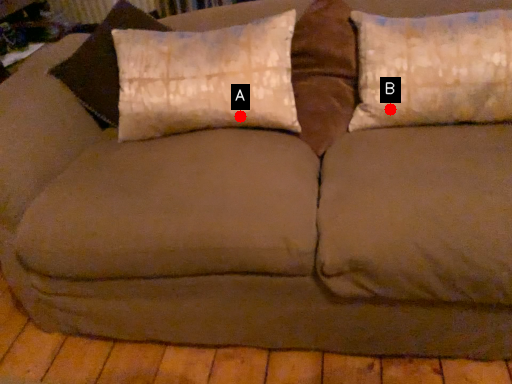
Question: Two points are circled on the image, labeled by A and B beside each circle. Which point is farther from the camera taking this photo?

Choices:
 (A) A is further
 (B) B is further

Answer: (A)